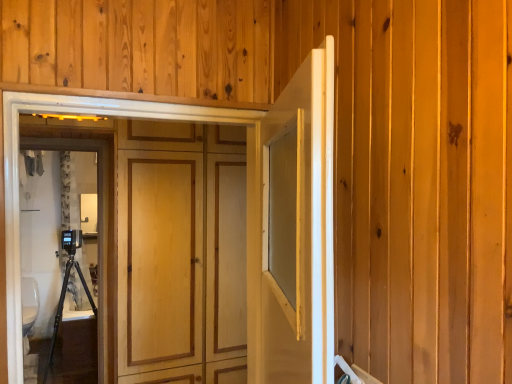
Question: Is black plastic camera on the left facing away from white glossy door at center, acting as the second door starting from the left?

Choices:
 (A) yes
 (B) no

Answer: (B)

Question: From the image's perspective, is black plastic camera on the left over white glossy door at center, acting as the second door starting from the left?

Choices:
 (A) yes
 (B) no

Answer: (B)

Question: From a real-world perspective, is black plastic camera on the left located higher than white glossy door at center, positioned as the first door in right-to-left order?

Choices:
 (A) yes
 (B) no

Answer: (B)

Question: Is black plastic camera on the left positioned in front of white glossy door at center, acting as the second door starting from the left?

Choices:
 (A) no
 (B) yes

Answer: (A)

Question: Does black plastic camera on the left come behind white glossy door at center, positioned as the first door in right-to-left order?

Choices:
 (A) no
 (B) yes

Answer: (B)

Question: Looking at the image, does black plastic camera on the left seem bigger or smaller compared to white glossy toilet bowl at lower left?

Choices:
 (A) big
 (B) small

Answer: (A)

Question: In the image, is black plastic camera on the left on the left side or the right side of white glossy toilet bowl at lower left?

Choices:
 (A) left
 (B) right

Answer: (B)

Question: Considering the positions of black plastic camera on the left and white glossy toilet bowl at lower left in the image, is black plastic camera on the left taller or shorter than white glossy toilet bowl at lower left?

Choices:
 (A) short
 (B) tall

Answer: (B)

Question: Is black plastic camera on the left situated inside white glossy toilet bowl at lower left or outside?

Choices:
 (A) inside
 (B) outside

Answer: (B)

Question: Choose the correct answer: Is black plastic camera on the left inside wooden panel at center, placed as the first door when sorted from left to right, or outside it?

Choices:
 (A) outside
 (B) inside

Answer: (A)

Question: Looking at their shapes, would you say black plastic camera on the left is wider or thinner than wooden panel at center, placed as the first door when sorted from left to right?

Choices:
 (A) thin
 (B) wide

Answer: (B)

Question: Is black plastic camera on the left taller or shorter than wooden panel at center, which ranks as the second door in right-to-left order?

Choices:
 (A) short
 (B) tall

Answer: (B)

Question: Does point (105, 231) appear closer or farther from the camera than point (247, 317)?

Choices:
 (A) closer
 (B) farther

Answer: (B)

Question: Is white glossy toilet bowl at lower left in front of or behind black plastic camera on the left in the image?

Choices:
 (A) front
 (B) behind

Answer: (B)

Question: Considering the relative positions of white glossy toilet bowl at lower left and black plastic camera on the left in the image provided, is white glossy toilet bowl at lower left to the left or to the right of black plastic camera on the left?

Choices:
 (A) left
 (B) right

Answer: (A)